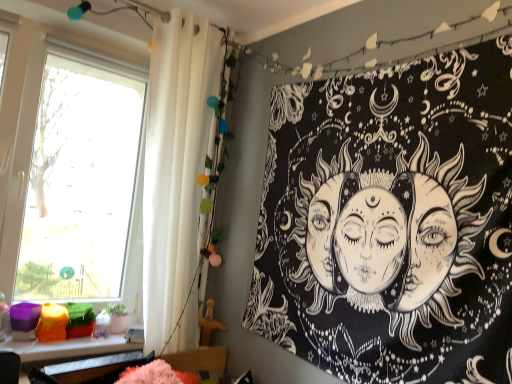
What is the approximate height of black paper tapestry at upper right?

black paper tapestry at upper right is 4.40 feet in height.

Locate an element on the screen. black paper tapestry at upper right is located at coordinates (391, 222).

Identify the location of plastic colorful objects at lower left. Image resolution: width=512 pixels, height=384 pixels. (66, 348).

Which is behind, black paper tapestry at upper right or plastic colorful objects at lower left?

plastic colorful objects at lower left.

Can you confirm if black paper tapestry at upper right is bigger than plastic colorful objects at lower left?

Correct, black paper tapestry at upper right is larger in size than plastic colorful objects at lower left.

Does point (276, 161) appear closer or farther from the camera than point (19, 344)?

Point (276, 161) is farther from the camera than point (19, 344).

Consider the image. Choose the correct answer: Is black paper tapestry at upper right inside plastic colorful objects at lower left or outside it?

black paper tapestry at upper right is outside plastic colorful objects at lower left.

This screenshot has height=384, width=512. In the image, there is a white fabric shower curtain at left. Find the location of `window below it (from a real-world perspective)`. window below it (from a real-world perspective) is located at coordinates (80, 184).

Is white fabric shower curtain at left positioned with its back to transparent glass window at left?

Yes, white fabric shower curtain at left is positioned with its back facing transparent glass window at left.

Based on the photo, from a real-world perspective, which is physically below, white fabric shower curtain at left or transparent glass window at left?

transparent glass window at left, from a real-world perspective.

Could you tell me if black paper tapestry at upper right is facing transparent glass window at left?

No, black paper tapestry at upper right is not oriented towards transparent glass window at left.

Consider the image. In terms of width, does black paper tapestry at upper right look wider or thinner when compared to transparent glass window at left?

black paper tapestry at upper right is thinner than transparent glass window at left.

Is black paper tapestry at upper right next to transparent glass window at left?

They are not placed beside each other.

Does black paper tapestry at upper right lie in front of transparent glass window at left?

Yes, it is.

Between plastic colorful objects at lower left and black paper tapestry at upper right, which one has larger width?

plastic colorful objects at lower left.

Can you tell me how much plastic colorful objects at lower left and black paper tapestry at upper right differ in facing direction?

There is a 90.5-degree angle between the facing directions of plastic colorful objects at lower left and black paper tapestry at upper right.

Visually, is plastic colorful objects at lower left positioned to the left or to the right of black paper tapestry at upper right?

From the image, it's evident that plastic colorful objects at lower left is to the left of black paper tapestry at upper right.

Is black paper tapestry at upper right surrounded by plastic colorful objects at lower left?

That's incorrect, black paper tapestry at upper right is not inside plastic colorful objects at lower left.

Choose the correct answer: Is plastic colorful objects at lower left inside transparent glass window at left or outside it?

plastic colorful objects at lower left is not inside transparent glass window at left, it's outside.

Between plastic colorful objects at lower left and transparent glass window at left, which one appears on the left side from the viewer's perspective?

Positioned to the left is transparent glass window at left.

From the image's perspective, which one is positioned lower, plastic colorful objects at lower left or transparent glass window at left?

plastic colorful objects at lower left appears lower in the image.

Consider the image. Is plastic colorful objects at lower left oriented away from transparent glass window at left?

No, plastic colorful objects at lower left's orientation is not away from transparent glass window at left.

Is plastic colorful objects at lower left oriented towards white fabric shower curtain at left?

No, plastic colorful objects at lower left does not turn towards white fabric shower curtain at left.

Can you confirm if plastic colorful objects at lower left is shorter than white fabric shower curtain at left?

Indeed, plastic colorful objects at lower left has a lesser height compared to white fabric shower curtain at left.

From the image's perspective, does plastic colorful objects at lower left appear higher than white fabric shower curtain at left?

No, from the image's perspective, plastic colorful objects at lower left is not over white fabric shower curtain at left.

Does transparent glass window at left have a greater width compared to black paper tapestry at upper right?

Correct, the width of transparent glass window at left exceeds that of black paper tapestry at upper right.

Between transparent glass window at left and black paper tapestry at upper right, which one has more height?

With more height is transparent glass window at left.

You are a GUI agent. You are given a task and a screenshot of the screen. Output one action in this format:
    pyautogui.click(x=<x>, y=<y>)
    Task: Click on the window above the black paper tapestry at upper right (from a real-world perspective)
    The width and height of the screenshot is (512, 384).
    Given the screenshot: What is the action you would take?
    pyautogui.click(x=80, y=184)

Is transparent glass window at left at the left side of black paper tapestry at upper right?

Correct, you'll find transparent glass window at left to the left of black paper tapestry at upper right.

Find the location of a particular element. The width and height of the screenshot is (512, 384). bulletin board on the right of the plastic colorful objects at lower left is located at coordinates (391, 222).

The image size is (512, 384). In order to click on shower curtain above the transparent glass window at left (from a real-world perspective) in this screenshot , I will do `click(175, 165)`.

When comparing their distances from white fabric shower curtain at left, does plastic colorful objects at lower left or transparent glass window at left seem further?

The object further to white fabric shower curtain at left is transparent glass window at left.

When comparing their distances from transparent glass window at left, does plastic colorful objects at lower left or black paper tapestry at upper right seem closer?

plastic colorful objects at lower left lies closer to transparent glass window at left than the other object.

When comparing their distances from black paper tapestry at upper right, does plastic colorful objects at lower left or transparent glass window at left seem further?

transparent glass window at left.

From the image, which object appears to be nearer to transparent glass window at left, black paper tapestry at upper right or plastic colorful objects at lower left?

The object closer to transparent glass window at left is plastic colorful objects at lower left.

Estimate the real-world distances between objects in this image. Which object is further from plastic colorful objects at lower left, white fabric shower curtain at left or black paper tapestry at upper right?

Among the two, black paper tapestry at upper right is located further to plastic colorful objects at lower left.

When comparing their distances from white fabric shower curtain at left, does plastic colorful objects at lower left or black paper tapestry at upper right seem closer?

plastic colorful objects at lower left lies closer to white fabric shower curtain at left than the other object.

Looking at the image, which one is located closer to black paper tapestry at upper right, white fabric shower curtain at left or plastic colorful objects at lower left?

white fabric shower curtain at left is positioned closer to the anchor black paper tapestry at upper right.

Estimate the real-world distances between objects in this image. Which object is further from plastic colorful objects at lower left, white fabric shower curtain at left or transparent glass window at left?

The object further to plastic colorful objects at lower left is transparent glass window at left.

Where is `shower curtain located between transparent glass window at left and black paper tapestry at upper right in the left-right direction`? The width and height of the screenshot is (512, 384). shower curtain located between transparent glass window at left and black paper tapestry at upper right in the left-right direction is located at coordinates (175, 165).

Where is `shower curtain between transparent glass window at left and plastic colorful objects at lower left vertically`? The width and height of the screenshot is (512, 384). shower curtain between transparent glass window at left and plastic colorful objects at lower left vertically is located at coordinates (175, 165).

At what (x,y) coordinates should I click in order to perform the action: click on shower curtain between plastic colorful objects at lower left and black paper tapestry at upper right. Please return your answer as a coordinate pair (x, y). The image size is (512, 384). Looking at the image, I should click on (175, 165).

What are the coordinates of `table between transparent glass window at left and black paper tapestry at upper right in the horizontal direction` in the screenshot? It's located at click(x=66, y=348).